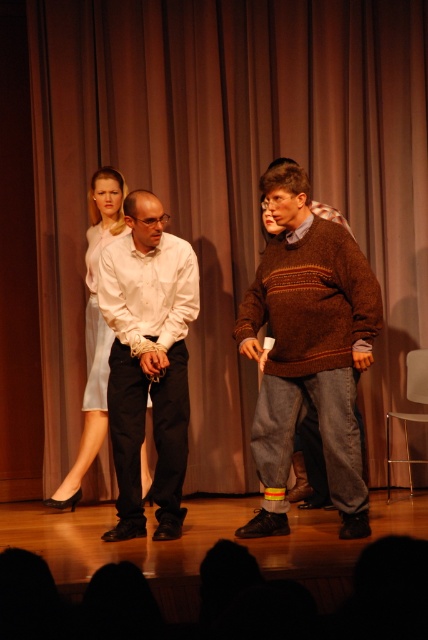
Is knitted brown sweater at center positioned at the back of brown woolen sweater at center?

No.

This screenshot has height=640, width=428. Identify the location of knitted brown sweater at center. (309, 349).

The height and width of the screenshot is (640, 428). Describe the element at coordinates (309, 349) in the screenshot. I see `knitted brown sweater at center` at that location.

Where is `knitted brown sweater at center`? This screenshot has height=640, width=428. knitted brown sweater at center is located at coordinates (309, 349).

Is point (130, 332) farther from viewer compared to point (88, 444)?

No, (130, 332) is closer to viewer.

Measure the distance from white shirt at center to light blue satin dress at center.

white shirt at center is 30.15 inches away from light blue satin dress at center.

Between point (171, 323) and point (118, 224), which one is positioned behind?

The point (118, 224) is behind.

I want to click on white shirt at center, so click(x=148, y=360).

Can you confirm if brown fabric curtain at center is bigger than light blue satin dress at center?

Correct, brown fabric curtain at center is larger in size than light blue satin dress at center.

Is point (50, 56) positioned behind point (118, 198)?

Yes, point (50, 56) is farther from viewer.

Between point (425, 176) and point (98, 435), which one is positioned in front?

Positioned in front is point (98, 435).

At what (x,y) coordinates should I click in order to perform the action: click on brown fabric curtain at center. Please return your answer as a coordinate pair (x, y). Looking at the image, I should click on (228, 179).